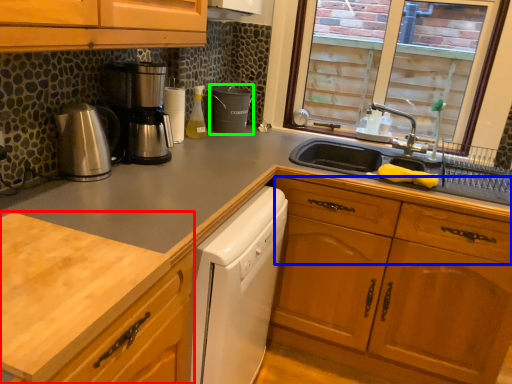
Question: Estimate the real-world distances between objects in this image. Which object is farther from countertop (highlighted by a red box), drawer (highlighted by a blue box) or appliance (highlighted by a green box)?

Choices:
 (A) drawer
 (B) appliance

Answer: (B)